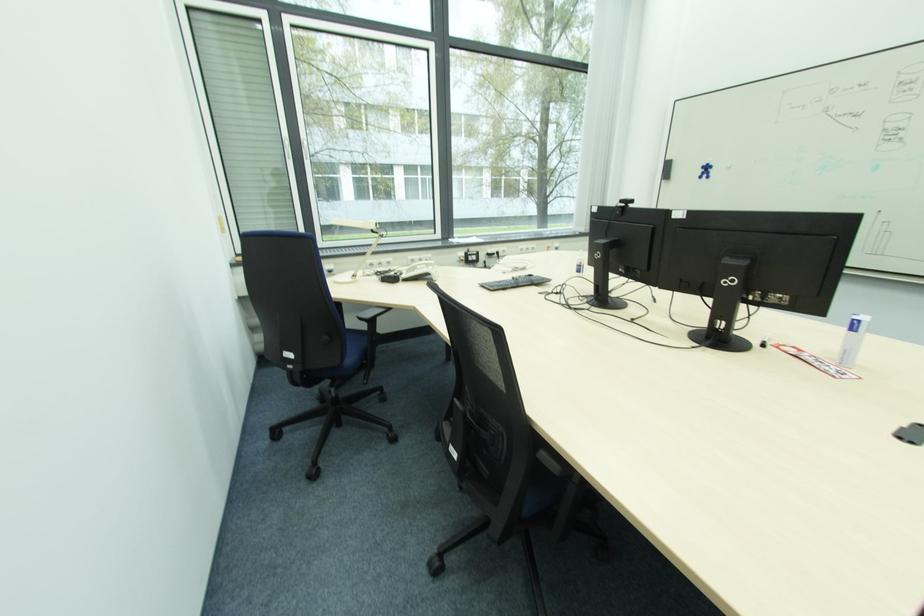
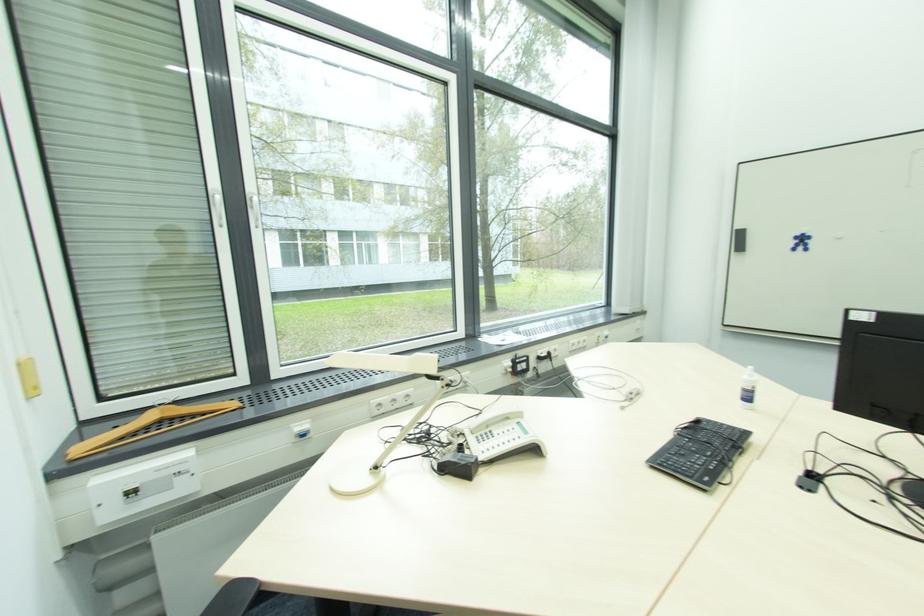
In the second image, find the point that corresponds to (x=357, y=278) in the first image.

(380, 469)